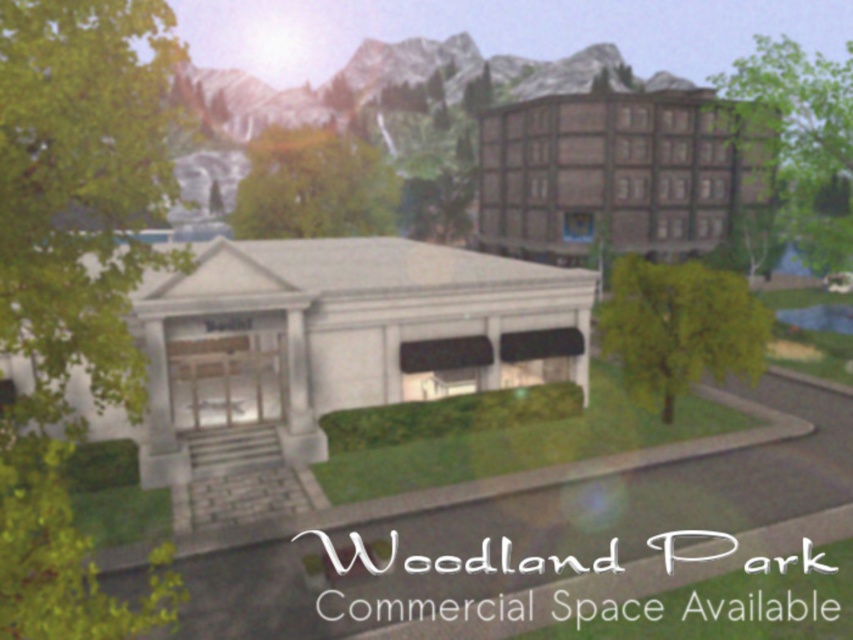
Can you confirm if white marble building at center is positioned above green leafy tree at center right?

Yes, white marble building at center is above green leafy tree at center right.

Is white marble building at center bigger than green leafy tree at center right?

Yes, white marble building at center is bigger than green leafy tree at center right.

This screenshot has height=640, width=853. What do you see at coordinates (331, 342) in the screenshot?
I see `white marble building at center` at bounding box center [331, 342].

This screenshot has height=640, width=853. What are the coordinates of `white marble building at center` in the screenshot? It's located at (331, 342).

Who is positioned more to the left, green leafy tree at upper right or green leafy tree at center?

Positioned to the left is green leafy tree at center.

Based on the photo, is green leafy tree at upper right to the right of green leafy tree at center from the viewer's perspective?

Yes, green leafy tree at upper right is to the right of green leafy tree at center.

Between point (776, 115) and point (245, 236), which one is positioned in front?

Positioned in front is point (776, 115).

The image size is (853, 640). Identify the location of green leafy tree at upper right. (799, 141).

Does green leafy tree at left appear on the right side of white marble building at center?

In fact, green leafy tree at left is to the left of white marble building at center.

Between green leafy tree at left and white marble building at center, which one has less height?

white marble building at center

Between point (32, 196) and point (451, 321), which one is positioned behind?

Point (451, 321)

You are a GUI agent. You are given a task and a screenshot of the screen. Output one action in this format:
    pyautogui.click(x=<x>, y=<y>)
    Task: Click on the green leafy tree at left
    This screenshot has width=853, height=640.
    Given the screenshot: What is the action you would take?
    pyautogui.click(x=74, y=282)